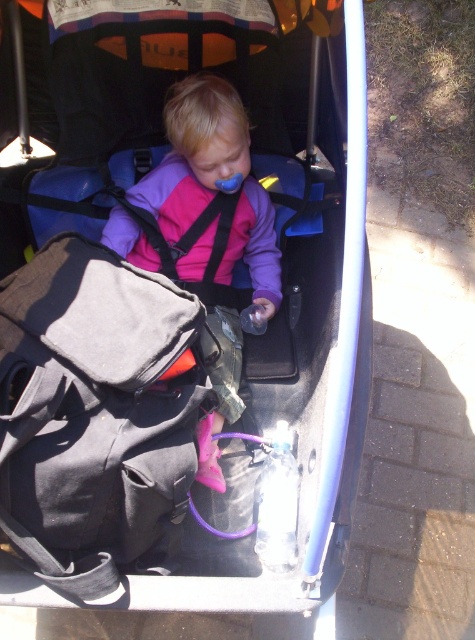
Question: Can you confirm if black fabric bag at lower left is positioned above pink matte jacket at center?

Choices:
 (A) no
 (B) yes

Answer: (A)

Question: Which point appears farthest from the camera in this image?

Choices:
 (A) (174, 276)
 (B) (94, 531)
 (C) (199, 131)

Answer: (A)

Question: Estimate the real-world distances between objects in this image. Which object is closer to the black fabric bag at lower left?

Choices:
 (A) pink matte jacket at center
 (B) black fabric strap at center

Answer: (A)

Question: Which object is farther from the camera taking this photo?

Choices:
 (A) black fabric bag at lower left
 (B) pink matte jacket at center
 (C) black fabric strap at center

Answer: (C)

Question: Observing the image, what is the correct spatial positioning of pink matte jacket at center in reference to black fabric strap at center?

Choices:
 (A) below
 (B) above

Answer: (A)

Question: Does pink matte jacket at center have a greater width compared to black fabric strap at center?

Choices:
 (A) no
 (B) yes

Answer: (B)